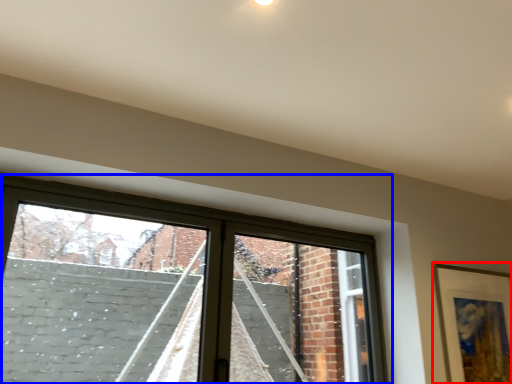
Question: Which object is further to the camera taking this photo, picture frame (highlighted by a red box) or window (highlighted by a blue box)?

Choices:
 (A) picture frame
 (B) window

Answer: (A)